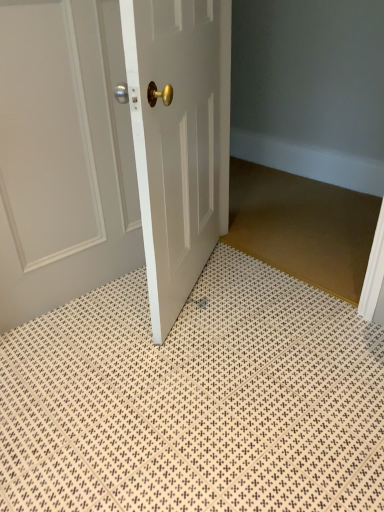
Question: Does white glossy door at center, which is the first door in right-to-left order, have a smaller size compared to white textured bath mat at center?

Choices:
 (A) yes
 (B) no

Answer: (B)

Question: Does white glossy door at center, the 2th door in the left-to-right sequence, have a lesser width compared to white textured bath mat at center?

Choices:
 (A) no
 (B) yes

Answer: (B)

Question: Does white glossy door at center, the 2th door in the left-to-right sequence, come in front of white textured bath mat at center?

Choices:
 (A) no
 (B) yes

Answer: (A)

Question: Would you say white glossy door at center, which is the first door in right-to-left order, is outside white textured bath mat at center?

Choices:
 (A) yes
 (B) no

Answer: (A)

Question: From the image's perspective, is white glossy door at center, which is the first door in right-to-left order, over white textured bath mat at center?

Choices:
 (A) yes
 (B) no

Answer: (A)

Question: Can you see white glossy door at center, which is the first door in right-to-left order, touching white textured bath mat at center?

Choices:
 (A) no
 (B) yes

Answer: (A)

Question: Is white textured bath mat at center looking in the opposite direction of white glossy door at upper left, placed as the first door when sorted from left to right?

Choices:
 (A) no
 (B) yes

Answer: (A)

Question: Considering the relative positions of white textured bath mat at center and white glossy door at upper left, placed as the first door when sorted from left to right, in the image provided, is white textured bath mat at center in front of white glossy door at upper left, placed as the first door when sorted from left to right,?

Choices:
 (A) yes
 (B) no

Answer: (A)

Question: Does white textured bath mat at center contain white glossy door at upper left, placed as the first door when sorted from left to right?

Choices:
 (A) no
 (B) yes

Answer: (A)

Question: Does white textured bath mat at center have a lesser height compared to white glossy door at upper left, which ranks as the second door in right-to-left order?

Choices:
 (A) yes
 (B) no

Answer: (A)

Question: Is white textured bath mat at center outside of white glossy door at upper left, placed as the first door when sorted from left to right?

Choices:
 (A) no
 (B) yes

Answer: (B)

Question: Is white textured bath mat at center positioned behind white glossy door at upper left, placed as the first door when sorted from left to right?

Choices:
 (A) yes
 (B) no

Answer: (B)

Question: From the image's perspective, is white glossy door at center, the 2th door in the left-to-right sequence, above brown textured mat at center?

Choices:
 (A) yes
 (B) no

Answer: (A)